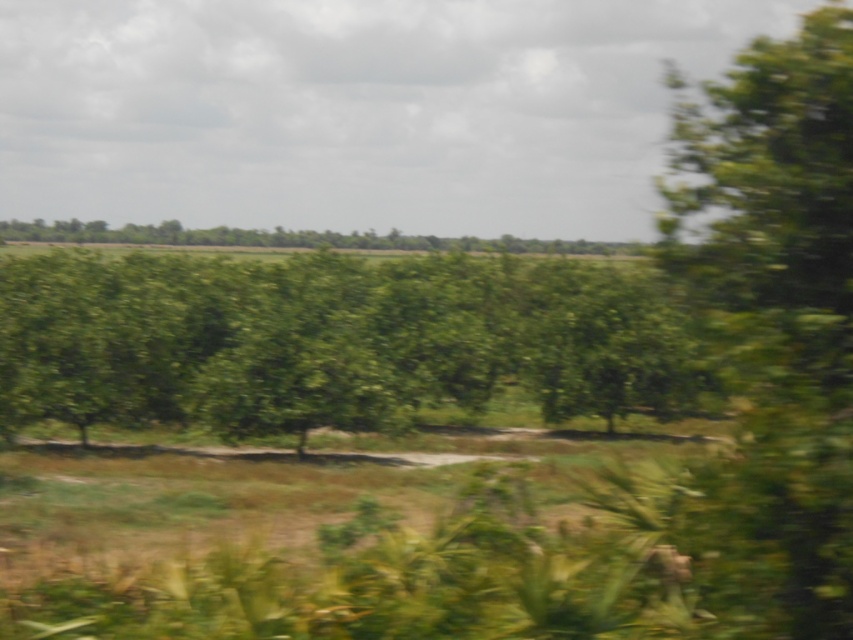
Between green leafy tree at center and green leafy tree at right, which one appears on the left side from the viewer's perspective?

green leafy tree at center is more to the left.

Is point (256, 266) positioned before point (717, 180)?

No, (256, 266) is behind (717, 180).

The height and width of the screenshot is (640, 853). What are the coordinates of `green leafy tree at center` in the screenshot? It's located at (329, 340).